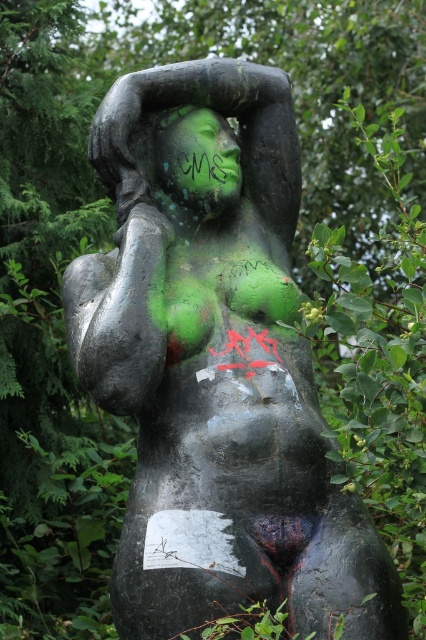
Question: Can you confirm if matte black statue at center is smaller than green matte face at center?

Choices:
 (A) no
 (B) yes

Answer: (A)

Question: Which point is closer to the camera taking this photo?

Choices:
 (A) (201, 148)
 (B) (275, 480)

Answer: (B)

Question: Is matte black statue at center in front of green matte face at center?

Choices:
 (A) no
 (B) yes

Answer: (B)

Question: Does matte black statue at center appear over green matte face at center?

Choices:
 (A) yes
 (B) no

Answer: (B)